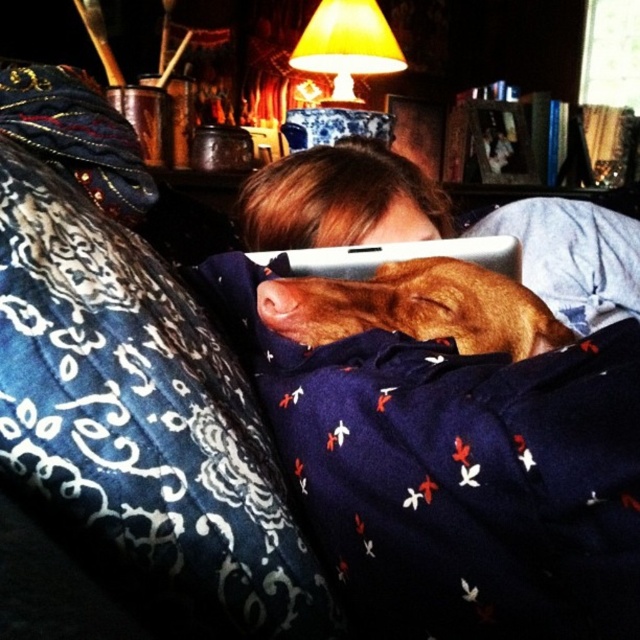
Question: Considering the real-world distances, which object is farthest from the brown furry dog at center?

Choices:
 (A) brown fur dog at center
 (B) yellow fabric lampshade at upper center

Answer: (B)

Question: Which of the following is the closest to the observer?

Choices:
 (A) brown fur dog at center
 (B) white matte tablet at center

Answer: (A)

Question: Where is brown furry dog at center located in relation to white matte tablet at center in the image?

Choices:
 (A) above
 (B) below

Answer: (B)

Question: Can you confirm if brown furry dog at center is smaller than white matte tablet at center?

Choices:
 (A) no
 (B) yes

Answer: (B)

Question: Is brown fur dog at center to the left of brown furry dog at center from the viewer's perspective?

Choices:
 (A) no
 (B) yes

Answer: (B)

Question: Which object is positioned farthest from the white matte tablet at center?

Choices:
 (A) brown furry dog at center
 (B) brown fur dog at center
 (C) yellow fabric lampshade at upper center

Answer: (C)